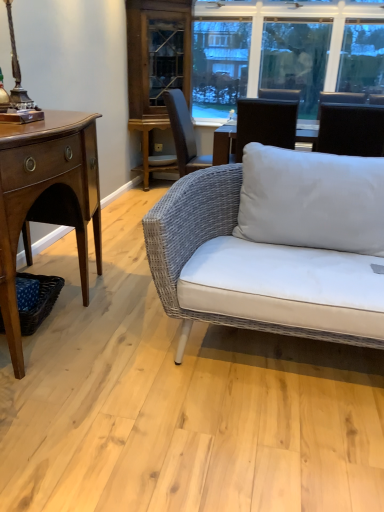
Where is `vacant area that lies to the right of blue woven picnic basket at lower left`? This screenshot has width=384, height=512. vacant area that lies to the right of blue woven picnic basket at lower left is located at coordinates (84, 329).